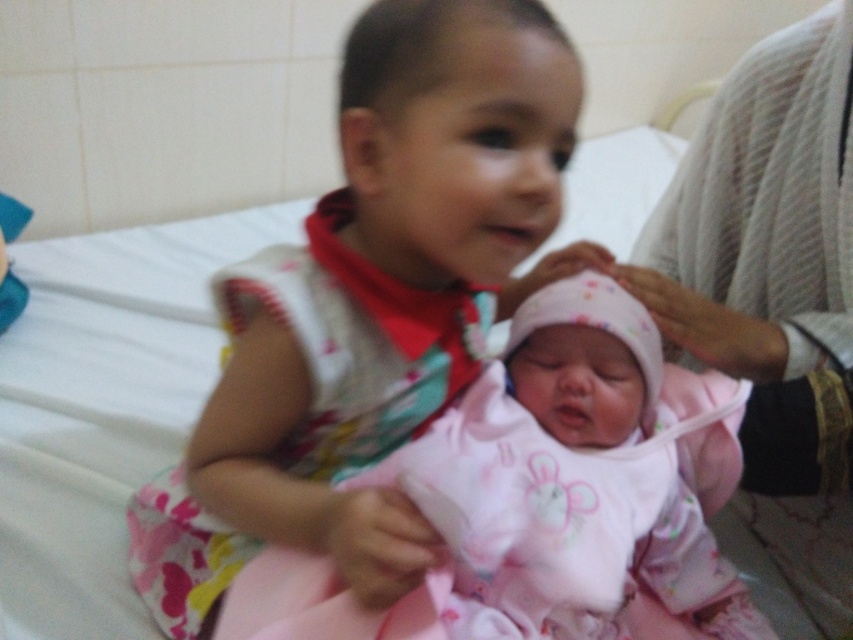
You are a nurse in the hospital room and need to reach the pink fabric baby at center to check its vitals. The matte pink dress at center is in your way. Can you easily move around the dress to access the baby?

The matte pink dress at center is closer to the viewer than pink fabric baby at center, so you can move around the dress to access the baby since it is in front of the baby.

You are a nurse in a hospital and need to place a medical chart on a table. The table is located at point 0.5, 0.5. The matte pink dress at center is at point 0.475, 0.436. Is the dress closer to the table than 0.1 units?

The matte pink dress at center is located at point (370, 304). The table is at (426, 320). The distance between them is sqrt

You are a nurse in a hospital room and need to place a new toy on the bed between the matte pink dress at center and the pink fabric baby at center. According to the scene description, where should you place the toy so it is equidistant from both objects?

The toy should be placed exactly in the middle between the matte pink dress at center and the pink fabric baby at center since the matte pink dress at center is on the left side of the pink fabric baby at center.